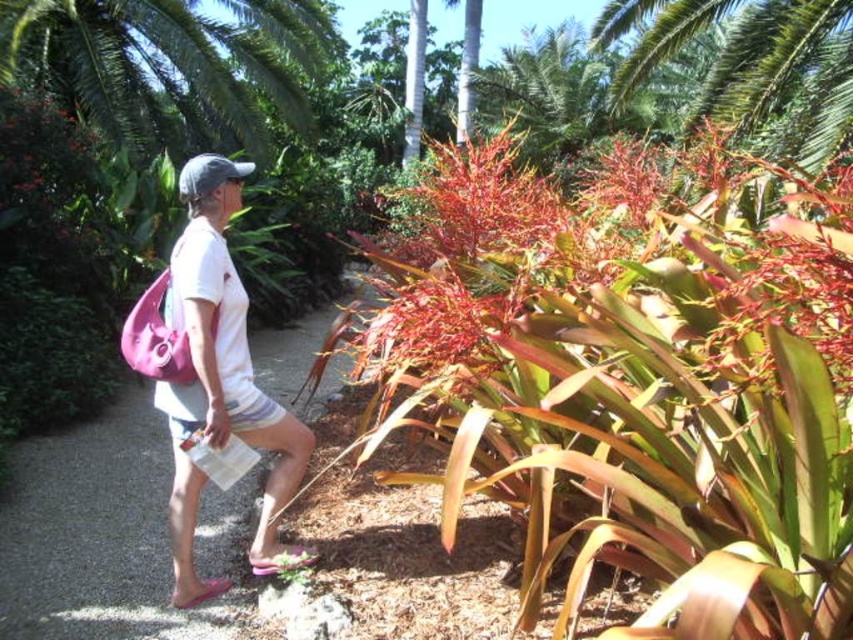
Question: Where is pink fabric bag at left located in relation to white fabric shirt at center in the image?

Choices:
 (A) above
 (B) below

Answer: (B)

Question: Based on their relative distances, which object is nearer to the white fabric shirt at center?

Choices:
 (A) green leafy palm tree at upper center
 (B) pink fabric bag at left

Answer: (B)

Question: Among these points, which one is farthest from the camera?

Choices:
 (A) (44, 72)
 (B) (218, 196)
 (C) (36, 621)

Answer: (A)

Question: Does pink fabric bag at left have a lesser width compared to green leafy palm tree at upper center?

Choices:
 (A) no
 (B) yes

Answer: (B)

Question: Can you confirm if pink fabric bag at left is thinner than green leafy palm tree at upper center?

Choices:
 (A) yes
 (B) no

Answer: (A)

Question: Which object is the farthest from the pink fabric bag at left?

Choices:
 (A) green leafy palm tree at upper center
 (B) white fabric shirt at center

Answer: (A)